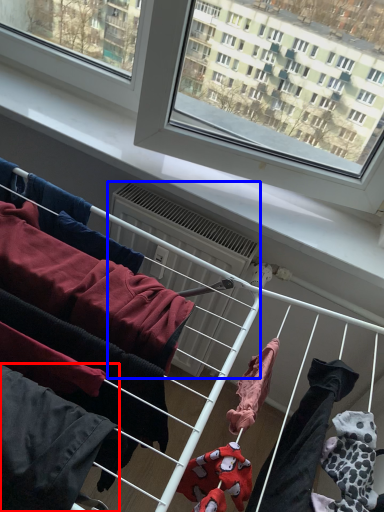
Question: Which of the following is the farthest to the observer, clothing (highlighted by a red box) or air conditioner (highlighted by a blue box)?

Choices:
 (A) clothing
 (B) air conditioner

Answer: (B)